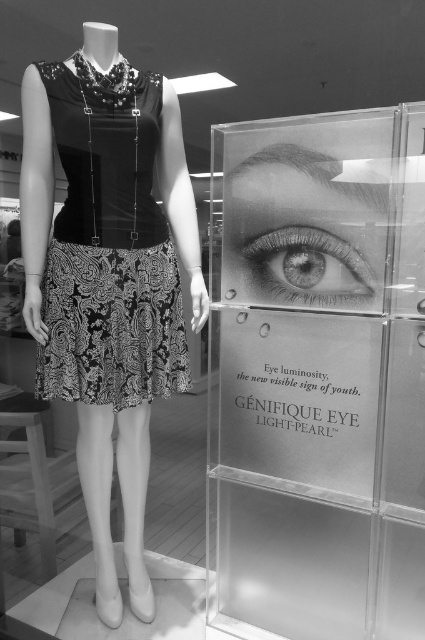
Who is taller, black satin dress at center or gray matte eye at center?

With more height is black satin dress at center.

Is black satin dress at center thinner than gray matte eye at center?

Incorrect, black satin dress at center's width is not less than gray matte eye at center's.

Where is `black satin dress at center`? Image resolution: width=425 pixels, height=640 pixels. black satin dress at center is located at coordinates (108, 246).

Is transparent acrylic at right above gray matte eye at center?

Actually, transparent acrylic at right is below gray matte eye at center.

Can you confirm if transparent acrylic at right is taller than gray matte eye at center?

Yes.

Is point (221, 497) farther from camera compared to point (305, 276)?

Yes, point (221, 497) is farther from viewer.

At what (x,y) coordinates should I click in order to perform the action: click on transparent acrylic at right. Please return your answer as a coordinate pair (x, y). Looking at the image, I should click on (317, 376).

Which is more to the left, transparent acrylic at right or black satin dress at center?

black satin dress at center

Does transparent acrylic at right have a greater width compared to black satin dress at center?

Yes.

Where is `transparent acrylic at right`? Image resolution: width=425 pixels, height=640 pixels. transparent acrylic at right is located at coordinates (317, 376).